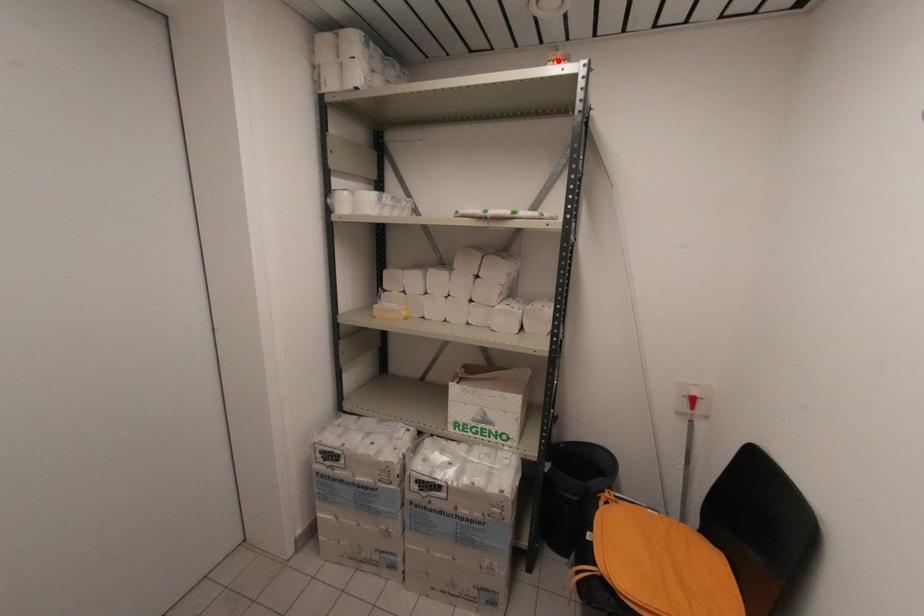
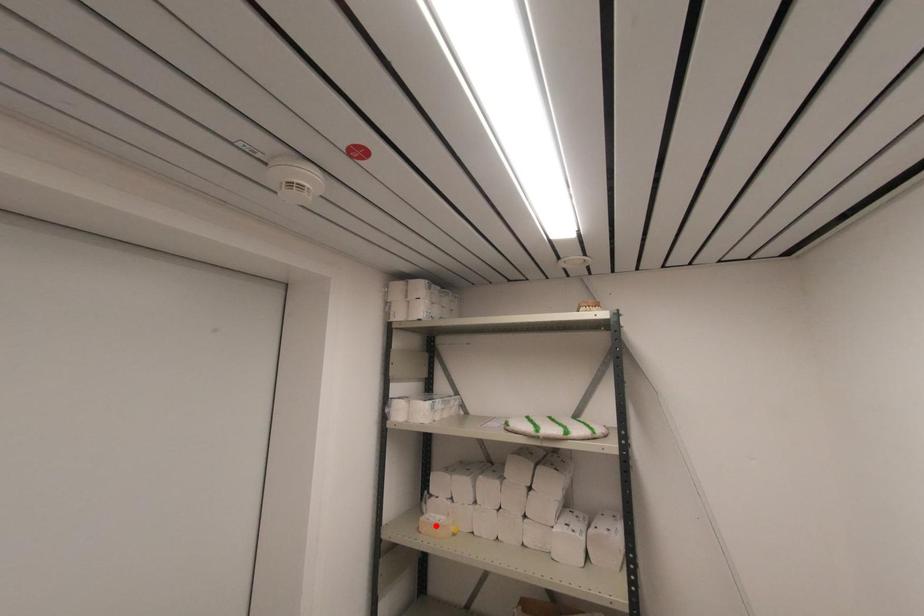
In the scene shown: I am providing you with two images of the same scene from different viewpoints. A red point is marked on the first image and another point is marked on the second image. Is the marked point in image1 the same physical position as the marked point in image2?

No